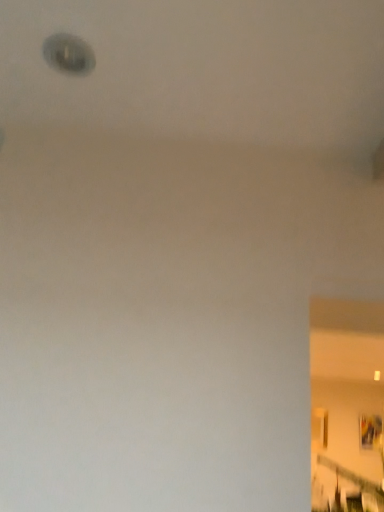
This screenshot has width=384, height=512. What do you see at coordinates (68, 54) in the screenshot?
I see `metallic circular hole at upper left` at bounding box center [68, 54].

In order to click on metallic circular hole at upper left in this screenshot , I will do `click(68, 54)`.

Based on the photo, what is the approximate height of metallic circular hole at upper left?

The height of metallic circular hole at upper left is 0.44 inches.

At what (x,y) coordinates should I click in order to perform the action: click on metallic circular hole at upper left. Please return your answer as a coordinate pair (x, y). This screenshot has width=384, height=512. Looking at the image, I should click on (68, 54).